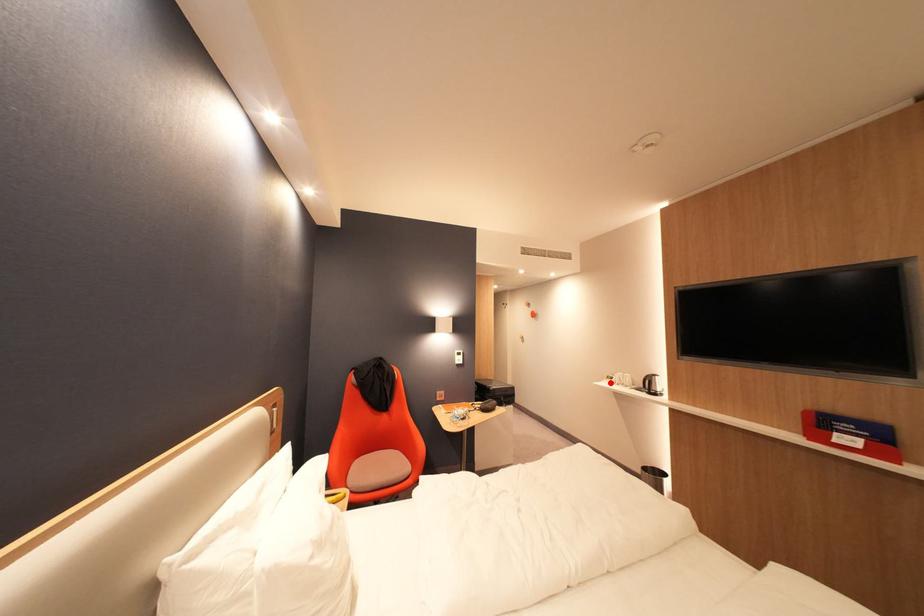
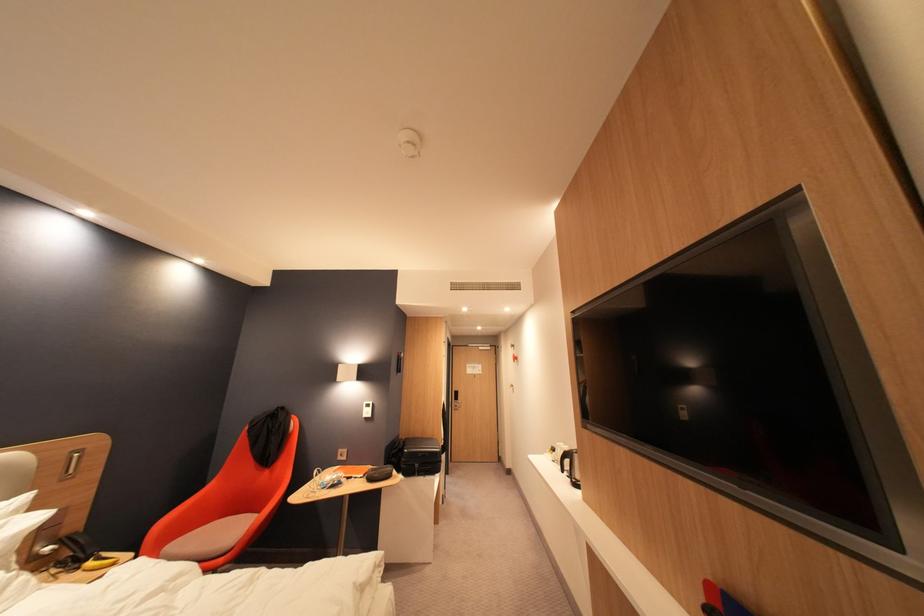
Where in the second image is the point corresponding to the highlighted location from the first image?

(553, 455)